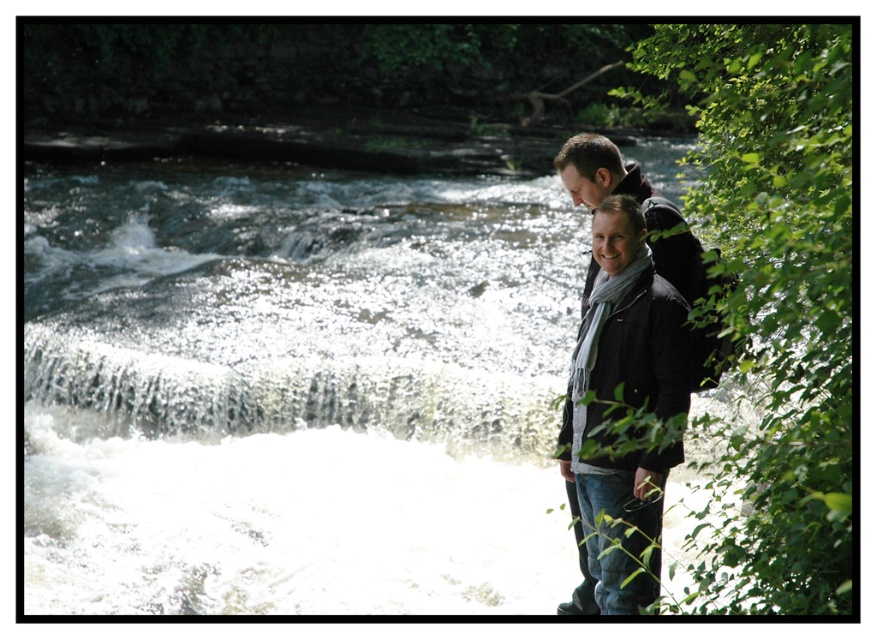
Question: Which object appears closest to the camera in this image?

Choices:
 (A) white frothy water at center
 (B) matte black jacket at right

Answer: (A)

Question: Observing the image, what is the correct spatial positioning of white frothy water at center in reference to matte black jacket at right?

Choices:
 (A) below
 (B) above

Answer: (B)

Question: Does white frothy water at center appear on the right side of matte black jacket at right?

Choices:
 (A) yes
 (B) no

Answer: (A)

Question: Does white frothy water at center have a smaller size compared to matte black jacket at right?

Choices:
 (A) yes
 (B) no

Answer: (B)

Question: Among these objects, which one is nearest to the camera?

Choices:
 (A) matte black jacket at right
 (B) white frothy water at center

Answer: (B)

Question: Among these points, which one is farthest from the camera?

Choices:
 (A) (619, 160)
 (B) (303, 566)

Answer: (B)